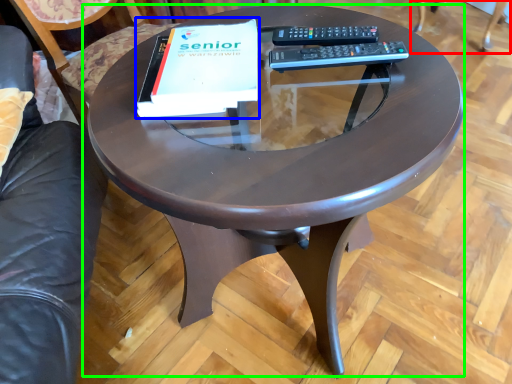
Question: Considering the real-world distances, which object is closest to swivel chair (highlighted by a red box)? paperback book (highlighted by a blue box) or coffee table (highlighted by a green box).

Choices:
 (A) paperback book
 (B) coffee table

Answer: (B)